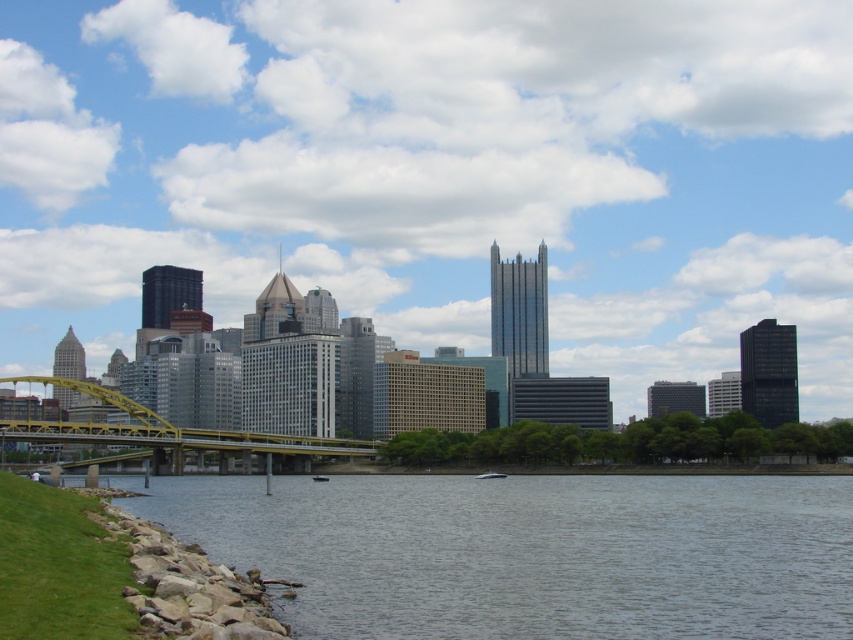
You are a photographer standing at the camera position wanting to capture the transparent glass bridge at center in your shot. Given that your camera can focus up to 400 meters, will you be able to capture the bridge clearly?

The transparent glass bridge at center and camera are 402.04 meters apart from each other, so the distance exceeds the camera focus limit of 400 meters. Therefore, the bridge may not be captured clearly.

You are a tourist standing on the grassy area near the gray smooth water at lower left. You want to cross the river to reach the modern buildings in the background. Is the transparent glass bridge at center the only path available to cross the river?

The transparent glass bridge at center is positioned over gray smooth water at lower left, so yes, it is the only path available to cross the river as described in the scene.